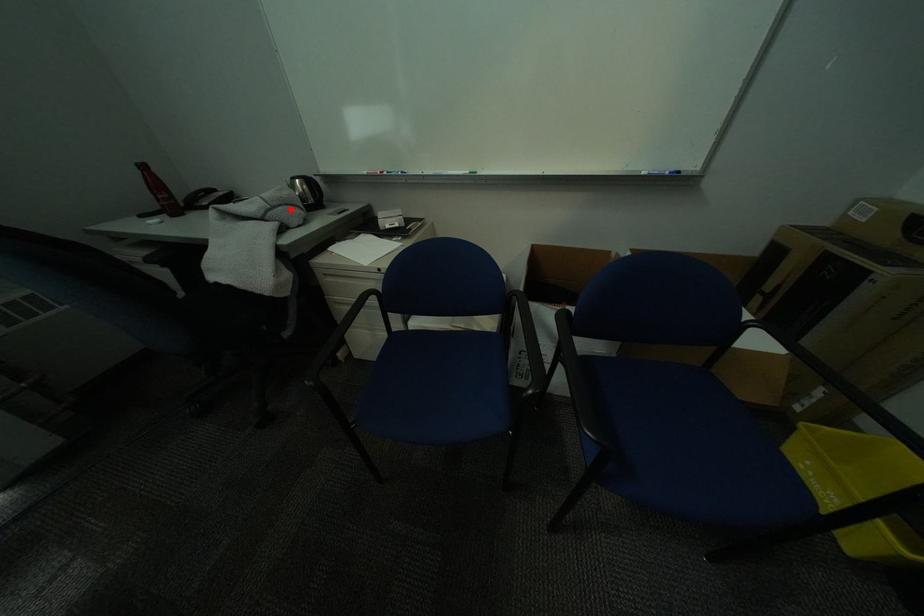
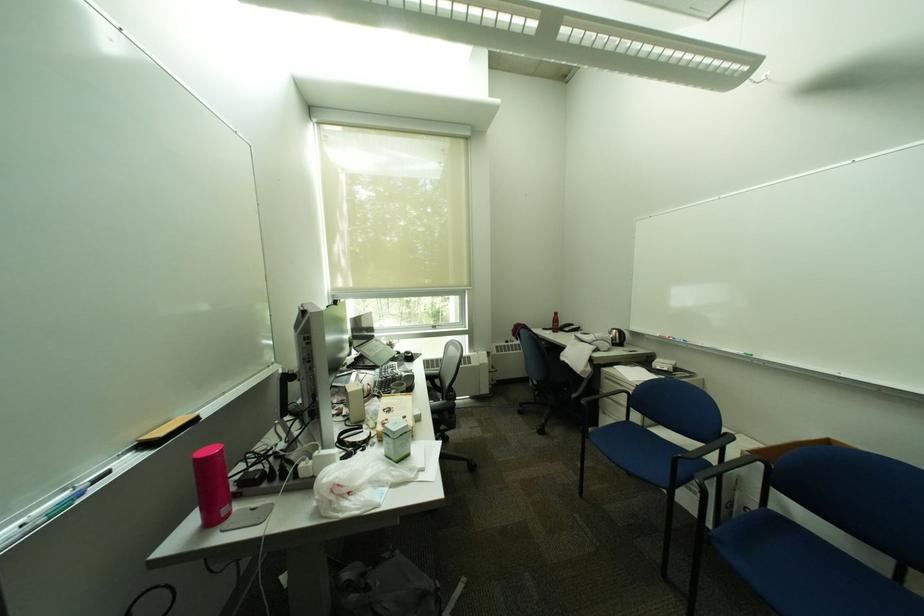
Where in the second image is the point corresponding to the highlighted location from the first image?

(611, 342)